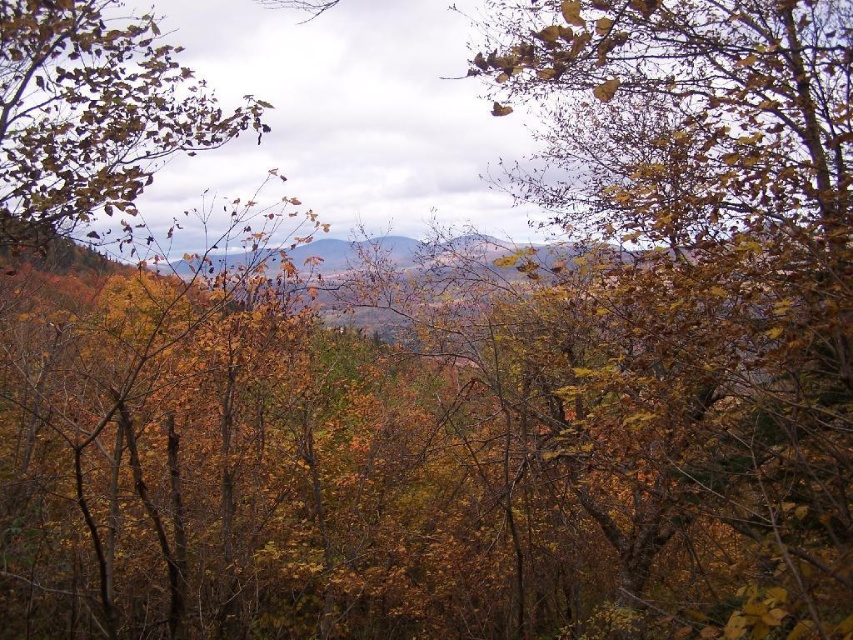
Is point (831, 12) positioned after point (107, 211)?

Yes, point (831, 12) is behind point (107, 211).

Between point (743, 356) and point (45, 132), which one is positioned behind?

Point (45, 132)

Does point (514, 76) come behind point (109, 51)?

Yes, point (514, 76) is farther from viewer.

Where is `golden-brown leaves at center`? golden-brown leaves at center is located at coordinates (717, 259).